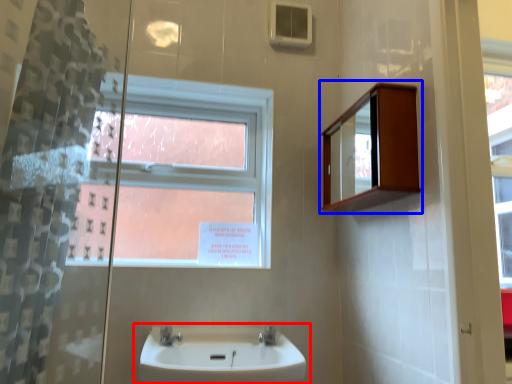
Question: Which of the following is the closest to the observer, sink (highlighted by a red box) or medicine cabinet (highlighted by a blue box)?

Choices:
 (A) sink
 (B) medicine cabinet

Answer: (A)